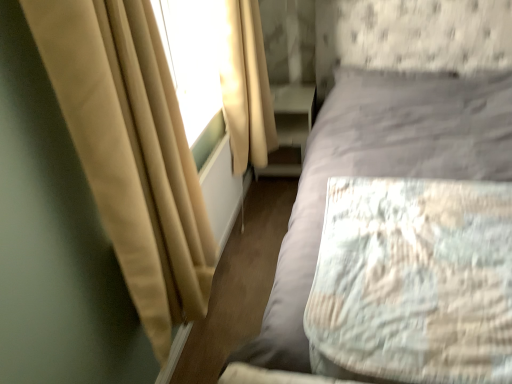
Question: Which is correct: light gray fabric mattress at right is inside textured gray bed at center, or outside of it?

Choices:
 (A) inside
 (B) outside

Answer: (A)

Question: Looking at their shapes, would you say light gray fabric mattress at right is wider or thinner than textured gray bed at center?

Choices:
 (A) thin
 (B) wide

Answer: (A)

Question: Considering the real-world distances, which object is closest to the beige fabric curtain at left, which appears as the first curtain when viewed from the front?

Choices:
 (A) light gray fabric mattress at right
 (B) beige fabric curtain at upper left, the 1th curtain when ordered from back to front
 (C) matte white dresser at lower center
 (D) textured gray bed at center

Answer: (A)

Question: Which object is the closest to the beige fabric curtain at left, placed as the 2th curtain when sorted from back to front?

Choices:
 (A) matte white dresser at lower center
 (B) beige fabric curtain at upper left, arranged as the second curtain when viewed from the front
 (C) textured gray bed at center
 (D) light gray fabric mattress at right

Answer: (D)